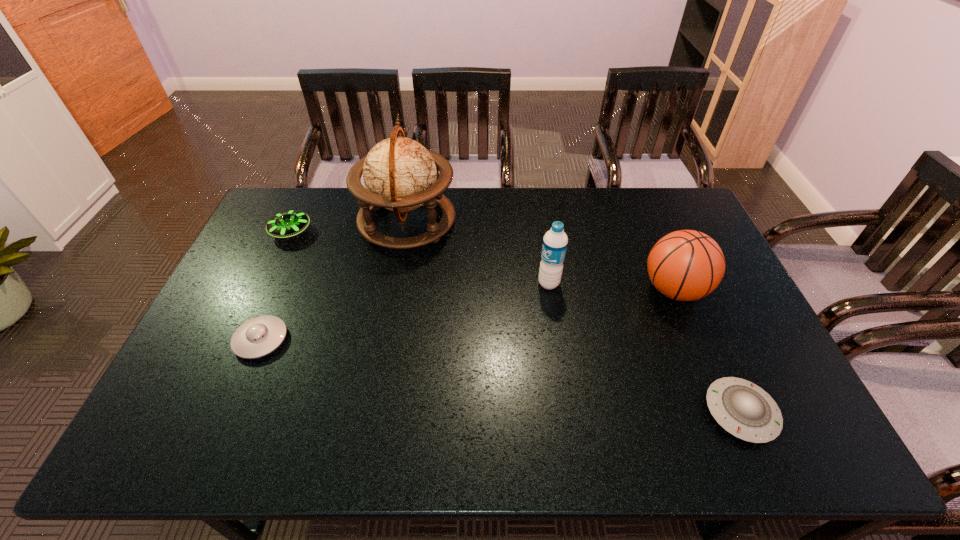
You are a GUI agent. You are given a task and a screenshot of the screen. Output one action in this format:
    pyautogui.click(x=<x>, y=<y>)
    Task: Click on the third closest saucer relative to the basketball
    This screenshot has height=540, width=960.
    Given the screenshot: What is the action you would take?
    pyautogui.click(x=286, y=224)

Where is `vacant region that satisfies the following two spatial constraints: 1. on the label of the fourth object from left to right; 2. on the back side of the rightmost saucer`? vacant region that satisfies the following two spatial constraints: 1. on the label of the fourth object from left to right; 2. on the back side of the rightmost saucer is located at coordinates (568, 412).